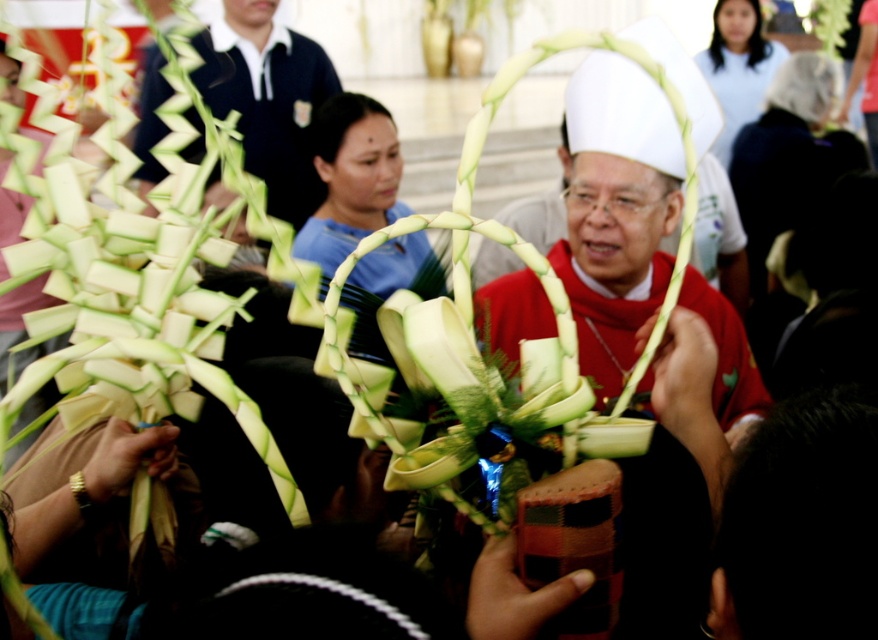
You are an observer at this event and need to determine the relative sizes of two items. Which object has a smaller width between the white matte hat at center and the matte black polo shirt at upper left?

The white matte hat at center has a smaller width compared to the matte black polo shirt at upper left.

You are attending a cultural event and see the white matte hat at center and the matte black polo shirt at upper left. Which one is positioned more to the right side?

The white matte hat at center is positioned more to the right side than the matte black polo shirt at upper left.

You are holding a camera and want to take a photo of the white matte hat at center. If you are standing 2.55 meters away from the hat, is the distance sufficient to capture the entire hat in the frame?

The white matte hat at center and camera are 2.55 meters apart from each other. This distance is sufficient to capture the entire hat in the frame as long as the camera has an appropriate lens or zoom capability.